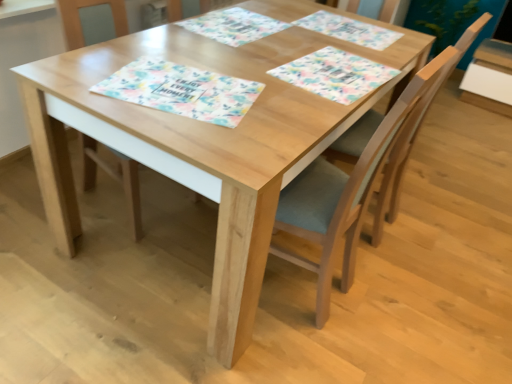
Question: From the image's perspective, would you say wooden chair at center, which is the second chair from left to right, is shown under floral paper placemat at center, acting as the 2th place mat starting from the front?

Choices:
 (A) yes
 (B) no

Answer: (A)

Question: From the image's perspective, is wooden chair at center, placed as the second chair when sorted from right to left, over floral paper placemat at center, which is the 3th place mat from back to front?

Choices:
 (A) no
 (B) yes

Answer: (A)

Question: Can you confirm if wooden chair at center, which is the second chair from left to right, is wider than floral paper placemat at center, acting as the 2th place mat starting from the front?

Choices:
 (A) no
 (B) yes

Answer: (B)

Question: From a real-world perspective, is wooden chair at center, which is the second chair from left to right, located beneath floral paper placemat at center, acting as the 2th place mat starting from the front?

Choices:
 (A) no
 (B) yes

Answer: (B)

Question: Is the position of wooden chair at center, placed as the second chair when sorted from right to left, more distant than that of floral paper placemat at center, acting as the 2th place mat starting from the front?

Choices:
 (A) no
 (B) yes

Answer: (A)

Question: Could floral paper placemat at center, acting as the 2th place mat starting from the front, be considered to be inside wooden chair at center, which is the second chair from left to right?

Choices:
 (A) no
 (B) yes

Answer: (B)

Question: Is floral paper placemat at upper center, the third place mat in the front-to-back sequence, at the back of wooden chair at center, which is the second chair from left to right?

Choices:
 (A) yes
 (B) no

Answer: (B)

Question: From the image's perspective, does wooden chair at center, placed as the second chair when sorted from right to left, appear higher than floral paper placemat at upper center, the 2th place mat viewed from the back?

Choices:
 (A) no
 (B) yes

Answer: (A)

Question: Are wooden chair at center, which is the second chair from left to right, and floral paper placemat at upper center, the third place mat in the front-to-back sequence, making contact?

Choices:
 (A) yes
 (B) no

Answer: (B)

Question: Does wooden chair at center, placed as the second chair when sorted from right to left, turn towards floral paper placemat at upper center, the 2th place mat viewed from the back?

Choices:
 (A) yes
 (B) no

Answer: (B)

Question: From a real-world perspective, is wooden chair at center, which is the second chair from left to right, physically below floral paper placemat at upper center, the third place mat in the front-to-back sequence?

Choices:
 (A) no
 (B) yes

Answer: (B)

Question: Is floral paper placemat at upper center, the third place mat in the front-to-back sequence, completely or partially inside wooden chair at center, placed as the second chair when sorted from right to left?

Choices:
 (A) no
 (B) yes

Answer: (A)

Question: Is wooden chair at center, which is the third chair in right-to-left order, facing away from wooden chair at center, placed as the second chair when sorted from right to left?

Choices:
 (A) yes
 (B) no

Answer: (B)